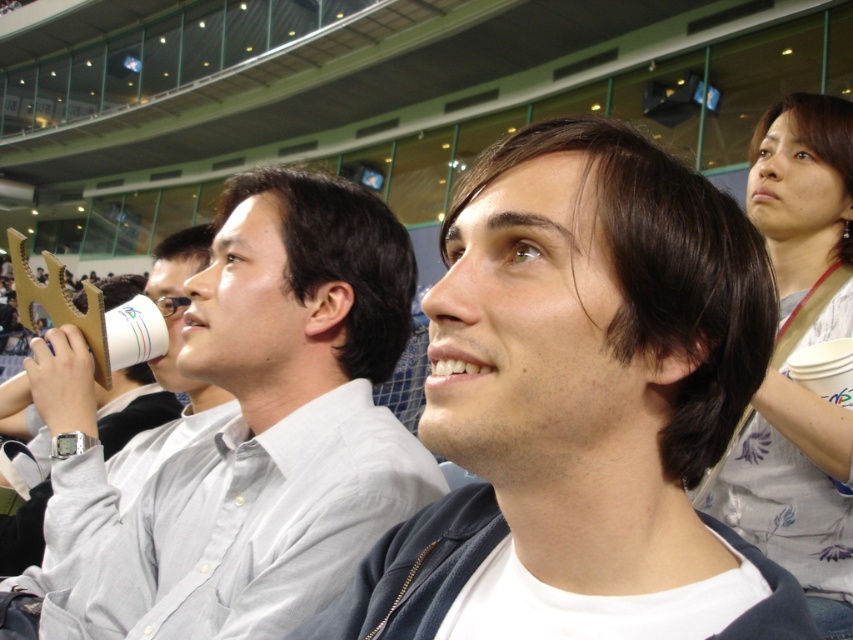
Based on the photo, who is taller, matte white shirt at center or white paper cup at center?

Standing taller between the two is white paper cup at center.

Is matte white shirt at center wider than white paper cup at center?

No.

Is point (531, 307) in front of point (274, 244)?

Yes.

I want to click on matte white shirt at center, so click(581, 381).